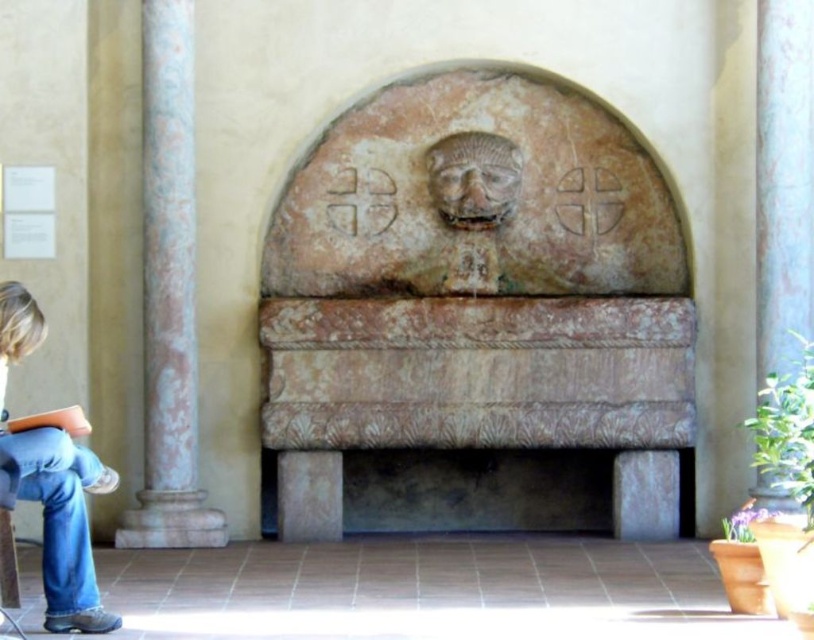
This screenshot has height=640, width=814. I want to click on rustic stone fountain at center, so click(475, 288).

This screenshot has height=640, width=814. I want to click on rustic stone fountain at center, so click(475, 288).

Is point (261, 268) less distant than point (195, 534)?

No, it is behind (195, 534).

Identify the location of rustic stone fountain at center. This screenshot has width=814, height=640. (475, 288).

Is marble column at left smaller than blue jeans at lower left?

Yes.

Which of these two, marble column at left or blue jeans at lower left, stands taller?

Standing taller between the two is marble column at left.

The height and width of the screenshot is (640, 814). What do you see at coordinates (169, 296) in the screenshot? I see `marble column at left` at bounding box center [169, 296].

Image resolution: width=814 pixels, height=640 pixels. What are the coordinates of `marble column at left` in the screenshot? It's located at (169, 296).